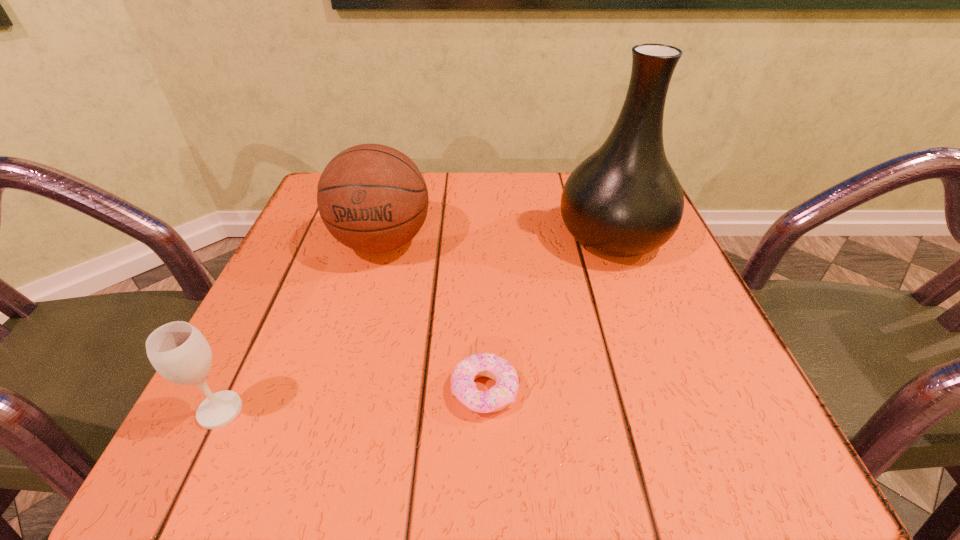
Locate an element on the screen. The width and height of the screenshot is (960, 540). free spot located on the right of the leftmost object is located at coordinates (518, 410).

Identify the location of free space located on the back of the doughnut. (483, 231).

This screenshot has width=960, height=540. What are the coordinates of `vase present at the far edge` in the screenshot? It's located at (624, 200).

Locate an element on the screen. The width and height of the screenshot is (960, 540). basketball present at the far edge is located at coordinates (372, 198).

The width and height of the screenshot is (960, 540). Identify the location of wineglass that is at the near edge. (178, 351).

Locate an element on the screen. The height and width of the screenshot is (540, 960). doughnut present at the near edge is located at coordinates (463, 387).

This screenshot has height=540, width=960. I want to click on basketball located at the left edge, so click(372, 198).

You are a GUI agent. You are given a task and a screenshot of the screen. Output one action in this format:
    pyautogui.click(x=<x>, y=<y>)
    Task: Click on the wineglass at the left edge
    
    Given the screenshot: What is the action you would take?
    pyautogui.click(x=178, y=351)

I want to click on object situated at the right edge, so click(x=624, y=200).

Where is `object situated at the far left corner`? object situated at the far left corner is located at coordinates (372, 198).